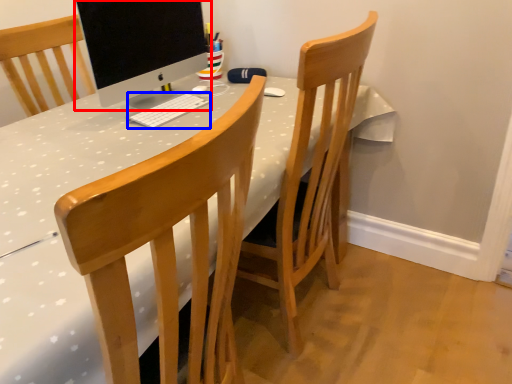
Question: Which object is closer to the camera taking this photo, computer monitor (highlighted by a red box) or computer keyboard (highlighted by a blue box)?

Choices:
 (A) computer monitor
 (B) computer keyboard

Answer: (A)